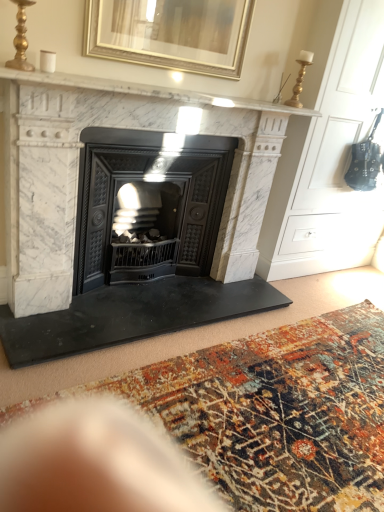
Question: Can you confirm if black cast iron wood burning stove at center is positioned to the right of gold metallic picture frame at upper center?

Choices:
 (A) no
 (B) yes

Answer: (A)

Question: Could you tell me if black cast iron wood burning stove at center is facing gold metallic picture frame at upper center?

Choices:
 (A) no
 (B) yes

Answer: (A)

Question: Is gold metallic picture frame at upper center at the back of black cast iron wood burning stove at center?

Choices:
 (A) yes
 (B) no

Answer: (B)

Question: Is black cast iron wood burning stove at center outside gold metallic picture frame at upper center?

Choices:
 (A) yes
 (B) no

Answer: (A)

Question: Does black cast iron wood burning stove at center lie in front of gold metallic picture frame at upper center?

Choices:
 (A) no
 (B) yes

Answer: (A)

Question: From a real-world perspective, is black cast iron wood burning stove at center positioned above or below white marble fireplace at upper center?

Choices:
 (A) above
 (B) below

Answer: (B)

Question: Would you say black cast iron wood burning stove at center is inside or outside white marble fireplace at upper center?

Choices:
 (A) outside
 (B) inside

Answer: (A)

Question: Does point (213, 252) appear closer or farther from the camera than point (36, 72)?

Choices:
 (A) farther
 (B) closer

Answer: (A)

Question: From the image's perspective, is black cast iron wood burning stove at center above or below white marble fireplace at upper center?

Choices:
 (A) below
 (B) above

Answer: (A)

Question: Is black cast iron wood burning stove at center in front of or behind white marble fireplace at center in the image?

Choices:
 (A) front
 (B) behind

Answer: (B)

Question: From their relative heights in the image, would you say black cast iron wood burning stove at center is taller or shorter than white marble fireplace at center?

Choices:
 (A) short
 (B) tall

Answer: (A)

Question: From a real-world perspective, is black cast iron wood burning stove at center positioned above or below white marble fireplace at center?

Choices:
 (A) below
 (B) above

Answer: (A)

Question: In terms of width, does black cast iron wood burning stove at center look wider or thinner when compared to white marble fireplace at center?

Choices:
 (A) wide
 (B) thin

Answer: (B)

Question: From the image's perspective, is black cast iron wood burning stove at center positioned above or below multicolored woven rug at center?

Choices:
 (A) above
 (B) below

Answer: (A)

Question: Considering their positions, is black cast iron wood burning stove at center located in front of or behind multicolored woven rug at center?

Choices:
 (A) front
 (B) behind

Answer: (B)